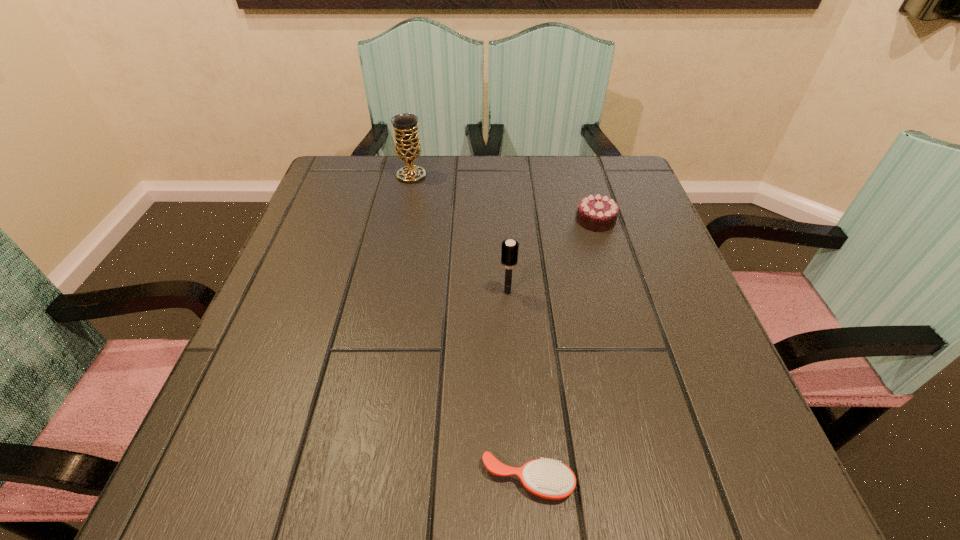
Image resolution: width=960 pixels, height=540 pixels. Find the location of `free spot between the farthest object and the taller hairbrush`. free spot between the farthest object and the taller hairbrush is located at coordinates (x=460, y=234).

You are a GUI agent. You are given a task and a screenshot of the screen. Output one action in this format:
    pyautogui.click(x=<x>, y=<y>)
    Task: Click on the free space between the nearer hairbrush and the leftmost object
    Image resolution: width=960 pixels, height=540 pixels.
    Given the screenshot: What is the action you would take?
    pyautogui.click(x=469, y=328)

Identify the location of free area in between the chocolate cake and the tallest object. The height and width of the screenshot is (540, 960). (503, 198).

Where is `object that ranks as the second closest to the chocolate cake`? The height and width of the screenshot is (540, 960). object that ranks as the second closest to the chocolate cake is located at coordinates (407, 145).

The width and height of the screenshot is (960, 540). In order to click on object that stands as the closest to the second shortest object in this screenshot , I will do `click(509, 248)`.

Locate an element on the screen. The height and width of the screenshot is (540, 960). vacant area in the image that satisfies the following two spatial constraints: 1. on the back side of the nearer hairbrush; 2. on the left side of the third nearest object is located at coordinates (509, 220).

I want to click on free space in the image that satisfies the following two spatial constraints: 1. on the back side of the third nearest object; 2. on the left side of the taller hairbrush, so click(503, 220).